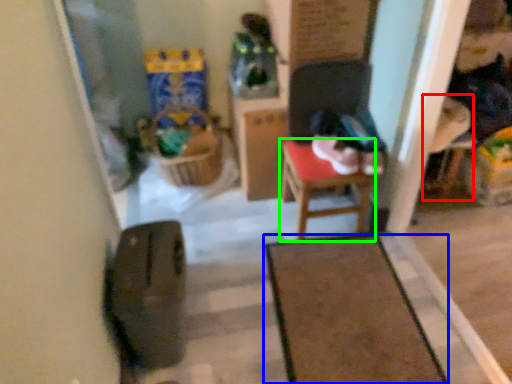
Question: Estimate the real-world distances between objects in this image. Which object is farther from armchair (highlighted by a red box), furniture (highlighted by a blue box) or table (highlighted by a green box)?

Choices:
 (A) furniture
 (B) table

Answer: (A)